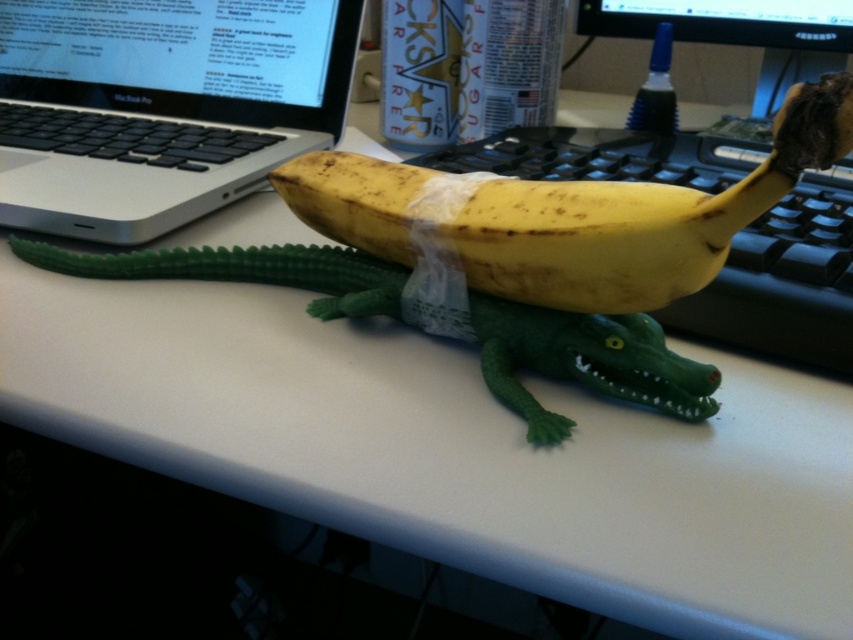
Can you confirm if silver metallic laptop at upper left is taller than glossy plastic monitor at upper center?

Correct, silver metallic laptop at upper left is much taller as glossy plastic monitor at upper center.

In the scene shown: Does silver metallic laptop at upper left appear over glossy plastic monitor at upper center?

Incorrect, silver metallic laptop at upper left is not positioned above glossy plastic monitor at upper center.

Image resolution: width=853 pixels, height=640 pixels. What are the coordinates of `silver metallic laptop at upper left` in the screenshot? It's located at (160, 106).

Is silver metallic laptop at upper left thinner than yellow matte banana at center?

Incorrect, silver metallic laptop at upper left's width is not less than yellow matte banana at center's.

Measure the distance between silver metallic laptop at upper left and camera.

The distance of silver metallic laptop at upper left from camera is 19.11 inches.

Which is in front, point (125, 13) or point (521, 208)?

Point (521, 208) is in front.

Where is `silver metallic laptop at upper left`? The image size is (853, 640). silver metallic laptop at upper left is located at coordinates (160, 106).

Measure the distance between point [782,36] and camera.

Point [782,36] is 29.74 inches from camera.

Does black glossy monitor at upper right have a greater height compared to glossy plastic monitor at upper center?

Correct, black glossy monitor at upper right is much taller as glossy plastic monitor at upper center.

Does point (682, 17) lie in front of point (819, 20)?

That is False.

Locate an element on the screen. The height and width of the screenshot is (640, 853). black glossy monitor at upper right is located at coordinates (738, 33).